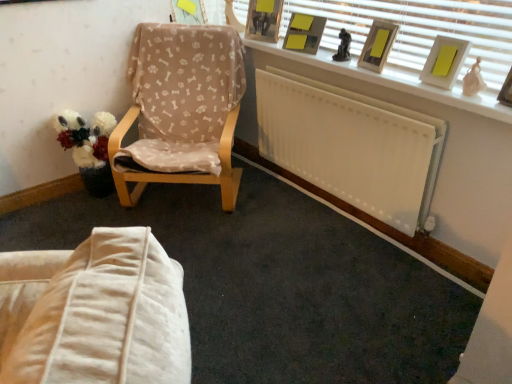
What do you see at coordinates (378, 45) in the screenshot? I see `matte wooden picture frame at upper right, placed as the 3th picture frame when sorted from front to back` at bounding box center [378, 45].

Describe the element at coordinates (445, 61) in the screenshot. I see `yellow matte picture frame at upper right, the fifth picture frame positioned from the left` at that location.

Describe the element at coordinates (264, 20) in the screenshot. This screenshot has width=512, height=384. I see `wooden picture frame at upper center, which is counted as the 2th picture frame, starting from the left` at that location.

The width and height of the screenshot is (512, 384). Describe the element at coordinates (304, 33) in the screenshot. I see `yellow matte picture frame at upper center, the 3th picture frame viewed from the back` at that location.

Describe the element at coordinates (181, 110) in the screenshot. I see `beige fabric chair at left` at that location.

The image size is (512, 384). What do you see at coordinates (188, 12) in the screenshot?
I see `matte yellow picture frame at upper center, the sixth picture frame when ordered from right to left` at bounding box center [188, 12].

This screenshot has height=384, width=512. Find the location of `matte wooden picture frame at upper right, the fourth picture frame when ordered from back to front`. matte wooden picture frame at upper right, the fourth picture frame when ordered from back to front is located at coordinates (378, 45).

Image resolution: width=512 pixels, height=384 pixels. In order to click on the 1st picture frame directly above the yellow matte picture frame at upper center, the 3th picture frame when ordered from left to right (from a real-world perspective) in this screenshot , I will do `click(378, 45)`.

Is yellow matte picture frame at upper center, the 3th picture frame when ordered from left to right, further to the viewer compared to matte wooden picture frame at upper right, the fourth picture frame when ordered from back to front?

Yes, it is behind matte wooden picture frame at upper right, the fourth picture frame when ordered from back to front.

In the scene shown: From the image's perspective, which object appears higher, yellow matte picture frame at upper center, which appears as the fourth picture frame when viewed from the front, or matte wooden picture frame at upper right, marked as the 4th picture frame in a left-to-right arrangement?

yellow matte picture frame at upper center, which appears as the fourth picture frame when viewed from the front, from the image's perspective.

Is fluffy fabric bouquet at left positioned with its back to white blinds at upper right?

fluffy fabric bouquet at left is not turned away from white blinds at upper right.

Is point (74, 113) less distant than point (461, 31)?

No, (74, 113) is behind (461, 31).

Is fluffy fabric bouquet at left bigger than white blinds at upper right?

Yes, fluffy fabric bouquet at left is bigger than white blinds at upper right.

Is fluffy fabric bouquet at left located outside white blinds at upper right?

That's correct, fluffy fabric bouquet at left is outside of white blinds at upper right.

Can you confirm if white blinds at upper right is positioned to the right of wooden picture frame at upper center, which is the 5th picture frame in front-to-back order?

Indeed, white blinds at upper right is positioned on the right side of wooden picture frame at upper center, which is the 5th picture frame in front-to-back order.

Find the location of `blind above the wooden picture frame at upper center, the fifth picture frame positioned from the right (from a real-world perspective)`. blind above the wooden picture frame at upper center, the fifth picture frame positioned from the right (from a real-world perspective) is located at coordinates (420, 29).

In the scene shown: From their relative heights in the image, would you say white blinds at upper right is taller or shorter than wooden picture frame at upper center, which is counted as the 2th picture frame, starting from the left?

Considering their sizes, white blinds at upper right has more height than wooden picture frame at upper center, which is counted as the 2th picture frame, starting from the left.

Are white blinds at upper right and wooden picture frame at upper center, which is the 5th picture frame in front-to-back order, far apart?

white blinds at upper right is near wooden picture frame at upper center, which is the 5th picture frame in front-to-back order, not far away.

Considering the relative sizes of wooden picture frame at upper right, which ranks as the first picture frame in front-to-back order, and white blinds at upper right in the image provided, is wooden picture frame at upper right, which ranks as the first picture frame in front-to-back order, thinner than white blinds at upper right?

No.

Is wooden picture frame at upper right, which ranks as the first picture frame in front-to-back order, beside white blinds at upper right?

They are not placed beside each other.

Is point (509, 103) closer or farther from the camera than point (473, 41)?

Point (509, 103) is positioned closer to the camera compared to point (473, 41).

How many degrees apart are the facing directions of matte wooden picture frame at upper right, the fourth picture frame when ordered from back to front, and white blinds at upper right?

16.1 degrees.

Considering the positions of objects matte wooden picture frame at upper right, placed as the 3th picture frame when sorted from front to back, and white blinds at upper right in the image provided, who is behind, matte wooden picture frame at upper right, placed as the 3th picture frame when sorted from front to back, or white blinds at upper right?

matte wooden picture frame at upper right, placed as the 3th picture frame when sorted from front to back.

Which object is positioned more to the left, matte wooden picture frame at upper right, the fourth picture frame when ordered from back to front, or white blinds at upper right?

Positioned to the left is white blinds at upper right.

Is matte wooden picture frame at upper right, the fourth picture frame when ordered from back to front, turned away from white blinds at upper right?

Yes.

From a real-world perspective, who is located lower, beige fabric chair at left or yellow matte picture frame at upper center, which appears as the fourth picture frame when viewed from the front?

beige fabric chair at left is physically lower.

Is beige fabric chair at left directly adjacent to yellow matte picture frame at upper center, which ranks as the fourth picture frame in right-to-left order?

No, beige fabric chair at left is not making contact with yellow matte picture frame at upper center, which ranks as the fourth picture frame in right-to-left order.

Which of these two, beige fabric chair at left or yellow matte picture frame at upper center, the 3th picture frame viewed from the back, is thinner?

yellow matte picture frame at upper center, the 3th picture frame viewed from the back.

From the image's perspective, is beige fabric chair at left beneath yellow matte picture frame at upper center, which ranks as the fourth picture frame in right-to-left order?

Yes.

Is fluffy fabric bouquet at left at the back of wooden picture frame at upper center, acting as the second picture frame starting from the back?

No, wooden picture frame at upper center, acting as the second picture frame starting from the back,'s orientation is not away from fluffy fabric bouquet at left.

From a real-world perspective, which object stands above the other?

From a 3D spatial view, wooden picture frame at upper center, acting as the second picture frame starting from the back, is above.

Can you confirm if wooden picture frame at upper center, which is counted as the 2th picture frame, starting from the left, is taller than fluffy fabric bouquet at left?

No.

Locate an element on the screen. The width and height of the screenshot is (512, 384). floral arrangement directly beneath the wooden picture frame at upper center, which is the 5th picture frame in front-to-back order (from a real-world perspective) is located at coordinates (85, 137).

Where is `the 1st picture frame above the matte wooden picture frame at upper right, placed as the 3th picture frame when sorted from front to back (from the image's perspective)`? Image resolution: width=512 pixels, height=384 pixels. the 1st picture frame above the matte wooden picture frame at upper right, placed as the 3th picture frame when sorted from front to back (from the image's perspective) is located at coordinates (304, 33).

The image size is (512, 384). I want to click on blind on the right of fluffy fabric bouquet at left, so point(420,29).

Considering their positions, is beige fabric chair at left positioned further to yellow matte picture frame at upper right, marked as the 2th picture frame in a right-to-left arrangement, than fluffy fabric bouquet at left?

fluffy fabric bouquet at left lies further to yellow matte picture frame at upper right, marked as the 2th picture frame in a right-to-left arrangement, than the other object.

Estimate the real-world distances between objects in this image. Which object is further from white blinds at upper right, yellow matte picture frame at upper right, the fifth picture frame positioned from the left, or matte wooden picture frame at upper right, placed as the 3th picture frame when sorted from front to back?

Among the two, yellow matte picture frame at upper right, the fifth picture frame positioned from the left, is located further to white blinds at upper right.

Estimate the real-world distances between objects in this image. Which object is closer to fluffy fabric bouquet at left, matte yellow picture frame at upper center, the first picture frame in the back-to-front sequence, or yellow matte picture frame at upper center, which ranks as the fourth picture frame in right-to-left order?

matte yellow picture frame at upper center, the first picture frame in the back-to-front sequence, is closer to fluffy fabric bouquet at left.

Considering their positions, is white blinds at upper right positioned further to wooden picture frame at upper center, which is counted as the 2th picture frame, starting from the left, than fluffy fabric bouquet at left?

Among the two, fluffy fabric bouquet at left is located further to wooden picture frame at upper center, which is counted as the 2th picture frame, starting from the left.

Considering their positions, is matte wooden picture frame at upper right, the third picture frame positioned from the right, positioned further to yellow matte picture frame at upper center, the 3th picture frame when ordered from left to right, than matte yellow picture frame at upper center, the first picture frame in the back-to-front sequence?

matte yellow picture frame at upper center, the first picture frame in the back-to-front sequence, is positioned further to the anchor yellow matte picture frame at upper center, the 3th picture frame when ordered from left to right.

Considering their positions, is white blinds at upper right positioned further to matte wooden picture frame at upper right, marked as the 4th picture frame in a left-to-right arrangement, than yellow matte picture frame at upper center, which appears as the fourth picture frame when viewed from the front?

yellow matte picture frame at upper center, which appears as the fourth picture frame when viewed from the front, lies further to matte wooden picture frame at upper right, marked as the 4th picture frame in a left-to-right arrangement, than the other object.

From the image, which object appears to be nearer to wooden picture frame at upper center, the fifth picture frame positioned from the right, matte wooden picture frame at upper right, marked as the 4th picture frame in a left-to-right arrangement, or white painted wood at upper right?

white painted wood at upper right lies closer to wooden picture frame at upper center, the fifth picture frame positioned from the right, than the other object.

Based on their spatial positions, is fluffy fabric bouquet at left or wooden picture frame at upper right, which is counted as the sixth picture frame, starting from the left, further from yellow matte picture frame at upper center, the 3th picture frame when ordered from left to right?

The object further to yellow matte picture frame at upper center, the 3th picture frame when ordered from left to right, is fluffy fabric bouquet at left.

Identify the location of window sill between wooden picture frame at upper right, which ranks as the first picture frame in front-to-back order, and wooden picture frame at upper center, which is counted as the 2th picture frame, starting from the left, from front to back. This screenshot has width=512, height=384. (394, 81).

At what (x,y) coordinates should I click in order to perform the action: click on blind between fluffy fabric bouquet at left and yellow matte picture frame at upper right, the fifth picture frame positioned from the left. Please return your answer as a coordinate pair (x, y). This screenshot has width=512, height=384. Looking at the image, I should click on (420, 29).

This screenshot has height=384, width=512. Identify the location of blind between fluffy fabric bouquet at left and wooden picture frame at upper right, which is the sixth picture frame from back to front, in the horizontal direction. (420, 29).

At what (x,y) coordinates should I click in order to perform the action: click on window sill between matte yellow picture frame at upper center, the first picture frame in the back-to-front sequence, and yellow matte picture frame at upper right, acting as the 5th picture frame starting from the back, in the horizontal direction. Please return your answer as a coordinate pair (x, y). The image size is (512, 384). Looking at the image, I should click on [x=394, y=81].